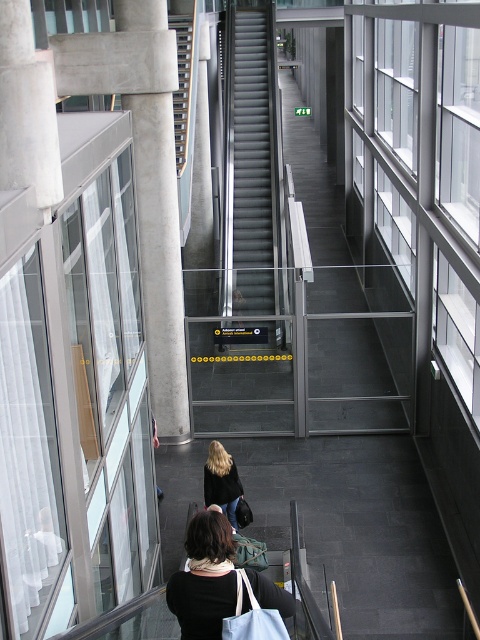
How much distance is there between white concrete pillar at left and blonde hair at center?

They are 3.82 meters apart.

Can you confirm if white concrete pillar at left is positioned to the left of blonde hair at center?

Indeed, white concrete pillar at left is positioned on the left side of blonde hair at center.

Who is more distant from viewer, (156, 17) or (206, 467)?

Positioned behind is point (156, 17).

At what (x,y) coordinates should I click in order to perform the action: click on white concrete pillar at left. Please return your answer as a coordinate pair (x, y). The width and height of the screenshot is (480, 640). Looking at the image, I should click on pyautogui.click(x=160, y=244).

Can you confirm if white concrete pillar at left is smaller than metallic gray stairs at center?

Correct, white concrete pillar at left occupies less space than metallic gray stairs at center.

Consider the image. Who is lower down, white concrete pillar at left or metallic gray stairs at center?

Positioned lower is white concrete pillar at left.

Is point (148, 320) less distant than point (184, 88)?

That is True.

The image size is (480, 640). In order to click on white concrete pillar at left in this screenshot , I will do `click(160, 244)`.

Who is higher up, black fabric bag at lower center or metallic gray stairs at center?

metallic gray stairs at center

Does black fabric bag at lower center have a lesser height compared to metallic gray stairs at center?

Incorrect, black fabric bag at lower center's height does not fall short of metallic gray stairs at center's.

Is point (236, 598) closer to viewer compared to point (178, 51)?

Yes, point (236, 598) is closer to viewer.

This screenshot has width=480, height=640. Identify the location of black fabric bag at lower center. (204, 579).